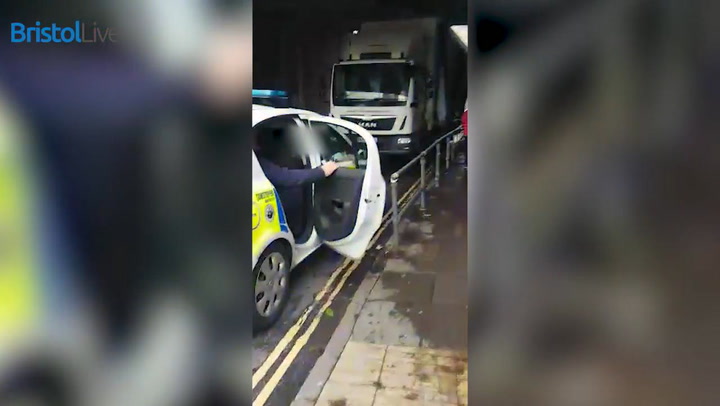
At what (x,y) coordinates should I click in order to perform the action: click on metallic railing. Please return your answer as a coordinate pair (x, y). The image size is (720, 406). Looking at the image, I should click on (423, 167).